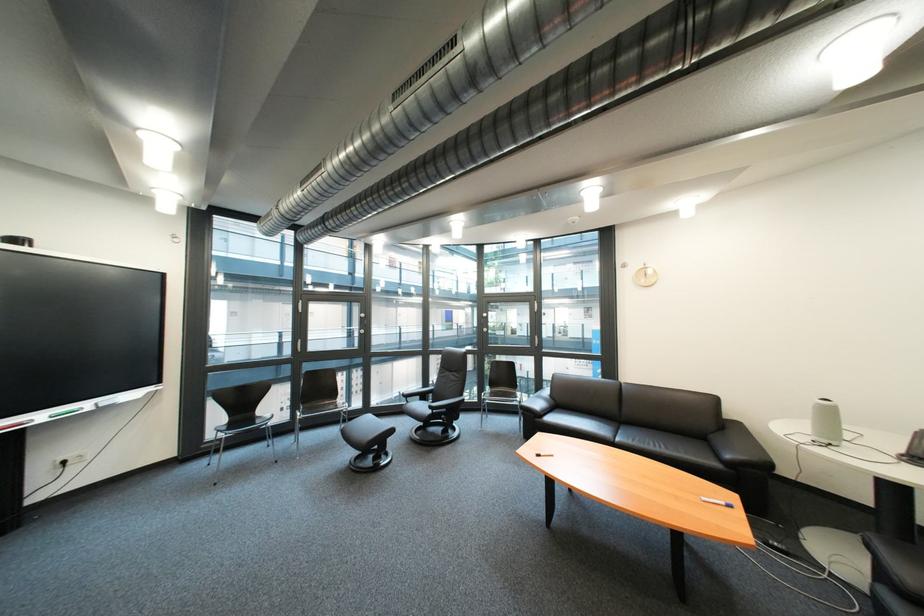
Identify the location of black sofa sitting surface. (654, 440).